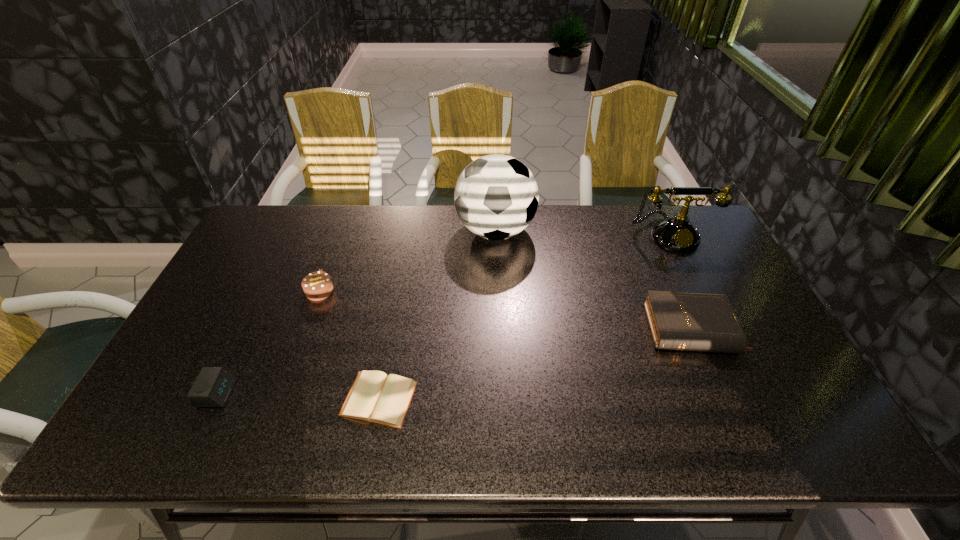
Locate an element on the screen. The image size is (960, 540). vacant region located on the main logo of the tallest object is located at coordinates (392, 231).

This screenshot has width=960, height=540. In order to click on vacant region located on the main logo of the tallest object in this screenshot , I will do `click(343, 231)`.

Locate an element on the screen. vacant region located 0.200m on the dial of the second tallest object is located at coordinates point(701,298).

What are the coordinates of `vacant space located 0.140m on the right of the fifth object from right to left` in the screenshot? It's located at (380, 291).

At what (x,y) coordinates should I click in order to perform the action: click on free region located 0.380m on the left of the third nearest object. Please return your answer as a coordinate pair (x, y). Looking at the image, I should click on (507, 329).

Identify the location of blank area located on the front-facing side of the leftmost object. (314, 393).

Image resolution: width=960 pixels, height=540 pixels. Find the location of `vacant region located on the right of the diary`. vacant region located on the right of the diary is located at coordinates (524, 399).

Find the location of `soccer ball present at the far edge`. soccer ball present at the far edge is located at coordinates (496, 196).

The height and width of the screenshot is (540, 960). Identify the location of telephone present at the far edge. (677, 233).

I want to click on object situated at the near edge, so click(375, 397).